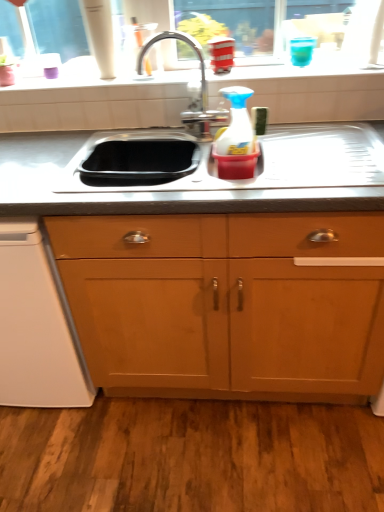
What are the coordinates of `free space in front of translucent plastic spray bottle at center` in the screenshot? It's located at (253, 183).